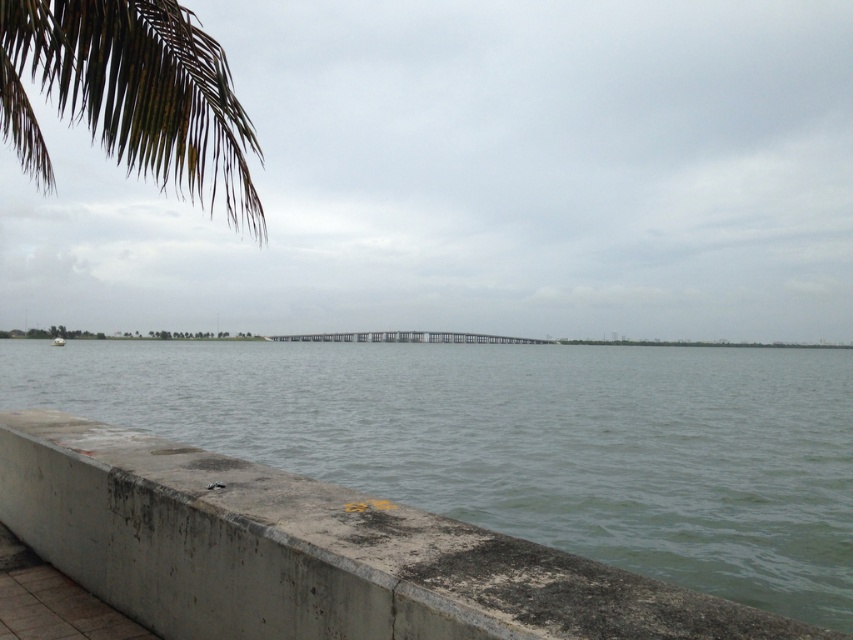
Does point (695, 432) come closer to viewer compared to point (395, 339)?

Yes, it is in front of point (395, 339).

Can you confirm if gray concrete water at center is positioned to the left of gray metallic rail at center?

Incorrect, gray concrete water at center is not on the left side of gray metallic rail at center.

Locate an element on the screen. gray concrete water at center is located at coordinates (525, 442).

Looking at this image, does gray concrete water at center have a lesser height compared to dark green leafy palm tree at upper left?

Yes, gray concrete water at center is shorter than dark green leafy palm tree at upper left.

The image size is (853, 640). Describe the element at coordinates (525, 442) in the screenshot. I see `gray concrete water at center` at that location.

Is point (714, 440) closer to viewer compared to point (213, 84)?

No.

The height and width of the screenshot is (640, 853). Identify the location of gray concrete water at center. (525, 442).

Does dark green leafy palm tree at upper left have a greater width compared to gray metallic rail at center?

Yes.

Does point (20, 74) come behind point (404, 337)?

No, it is in front of (404, 337).

You are a GUI agent. You are given a task and a screenshot of the screen. Output one action in this format:
    pyautogui.click(x=<x>, y=<y>)
    Task: Click on the dark green leafy palm tree at upper left
    
    Given the screenshot: What is the action you would take?
    pyautogui.click(x=129, y=93)